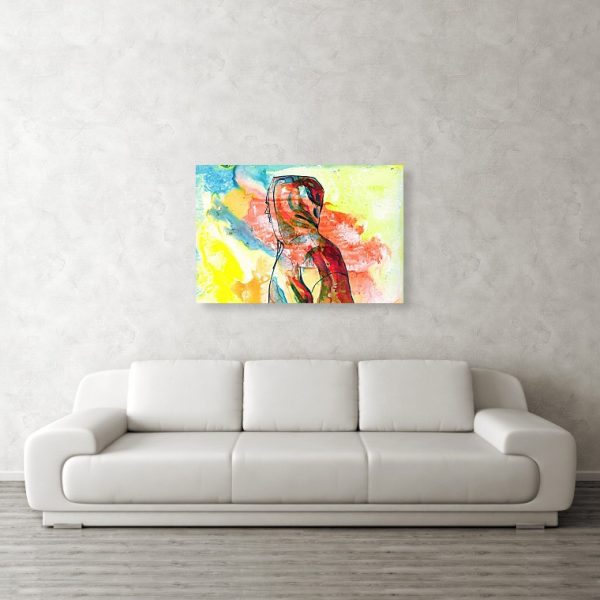
The image size is (600, 600). Identify the location of sofa. (516, 466).